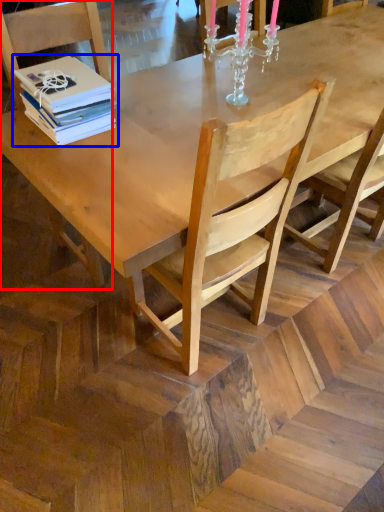
Question: Among these objects, which one is nearest to the camera, chair (highlighted by a red box) or book (highlighted by a blue box)?

Choices:
 (A) chair
 (B) book

Answer: (A)